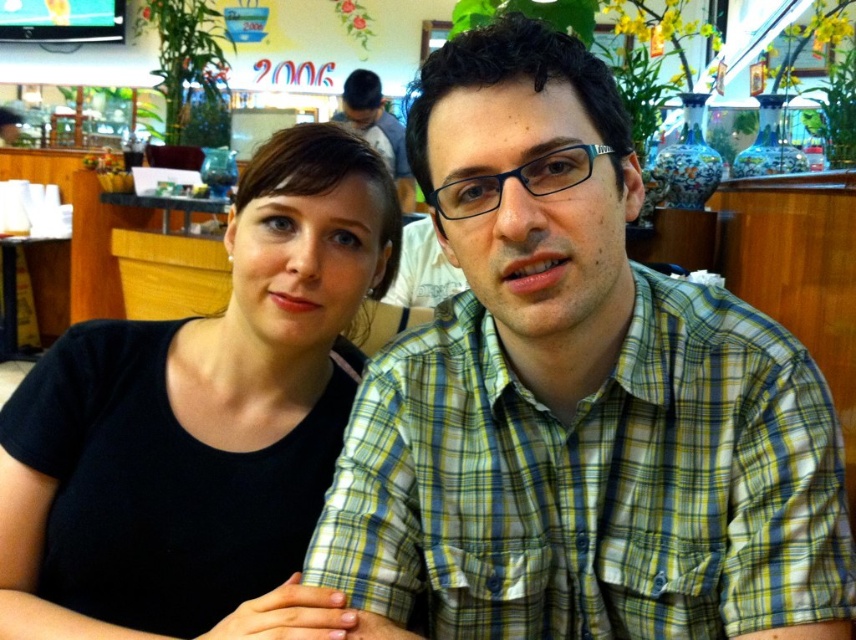
Does green plaid shirt at center appear under black matte shirt at left?

Yes.

Between green plaid shirt at center and black matte shirt at left, which one appears on the left side from the viewer's perspective?

Positioned to the left is black matte shirt at left.

Is point (825, 532) positioned after point (241, 486)?

No.

The height and width of the screenshot is (640, 856). Identify the location of green plaid shirt at center. (593, 483).